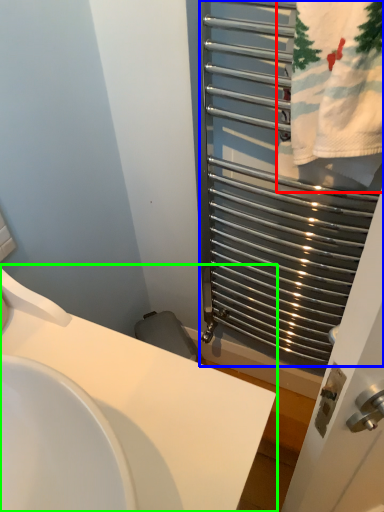
Question: Which is farther away from bath towel (highlighted by a red box)? cage (highlighted by a blue box) or sink (highlighted by a green box)?

Choices:
 (A) cage
 (B) sink

Answer: (B)